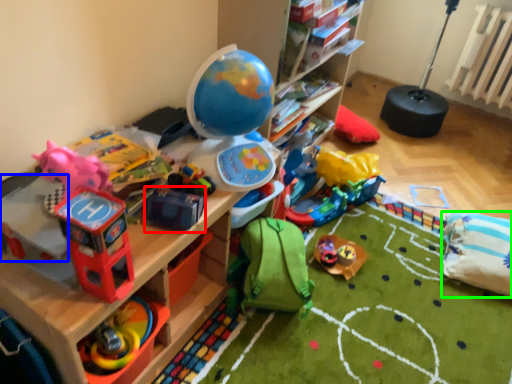
Question: Which object is the closest to the toy (highlighted by a red box)? Choose among these: toy (highlighted by a blue box) or pillow (highlighted by a green box).

Choices:
 (A) toy
 (B) pillow

Answer: (A)